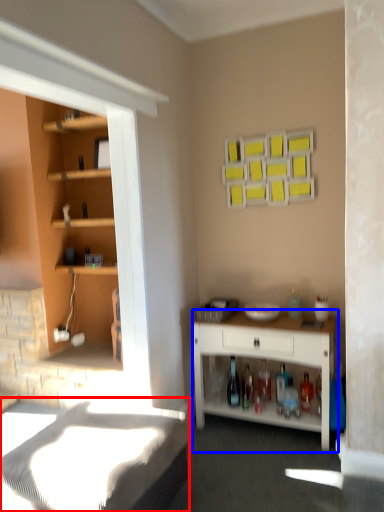
Question: Which point is closer to the camera, bed frame (highlighted by a red box) or desk (highlighted by a blue box)?

Choices:
 (A) bed frame
 (B) desk

Answer: (A)